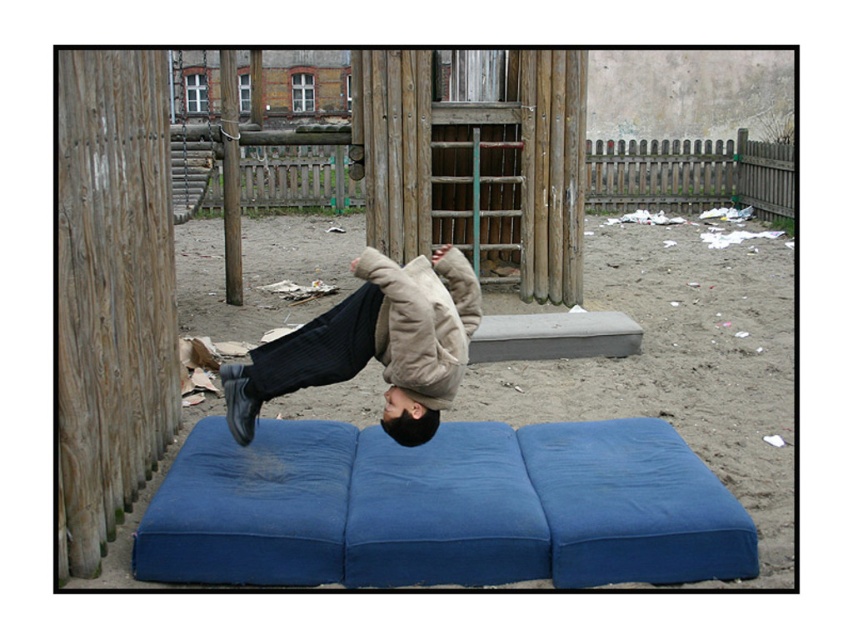
Question: Considering the real-world distances, which object is farthest from the brushed metal swing at upper center?

Choices:
 (A) sandy brown sand at center
 (B) beige woolen jacket at center

Answer: (A)

Question: Which point is farther from the camera taking this photo?

Choices:
 (A) (791, 484)
 (B) (184, 161)
 (C) (461, 257)

Answer: (B)

Question: In this image, where is beige woolen jacket at center located relative to brushed metal swing at upper center?

Choices:
 (A) below
 (B) above

Answer: (A)

Question: Observing the image, what is the correct spatial positioning of sandy brown sand at center in reference to beige woolen jacket at center?

Choices:
 (A) left
 (B) right

Answer: (B)

Question: Among these points, which one is nearest to the camera?

Choices:
 (A) (204, 196)
 (B) (218, 241)
 (C) (236, 384)

Answer: (C)

Question: Does beige woolen jacket at center appear on the right side of brushed metal swing at upper center?

Choices:
 (A) no
 (B) yes

Answer: (B)